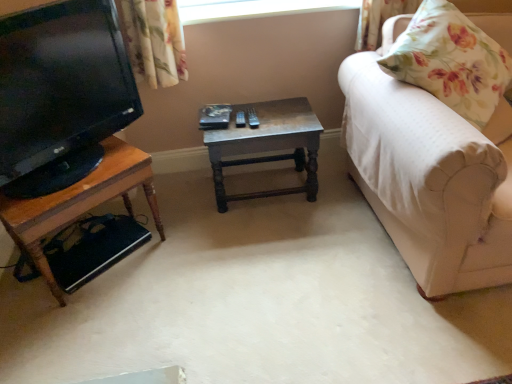
Locate an element on the screen. Image resolution: width=512 pixels, height=384 pixels. vacant area located to the right-hand side of woodenobject at left, the 1th table positioned from the left is located at coordinates (190, 252).